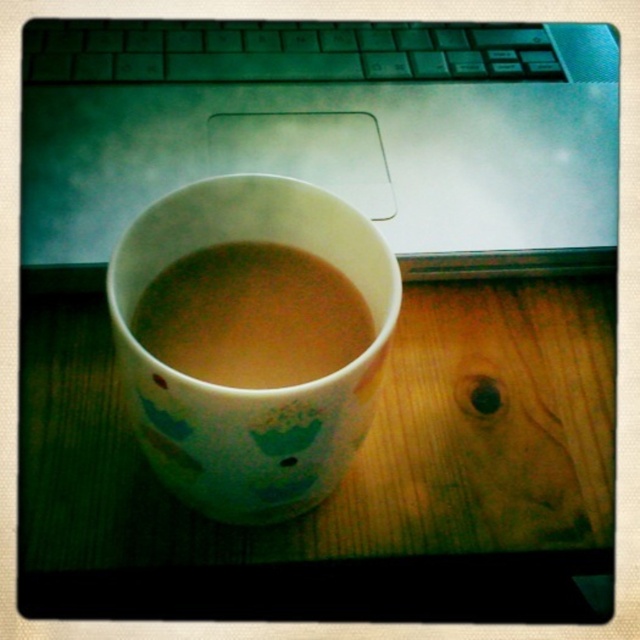
You are trying to reach for the brown matte cup at center while your hand is near the black plastic keyboard at upper center. Will your hand collide with the keyboard when reaching for the cup?

The brown matte cup at center is behind the black plastic keyboard at upper center, so your hand would have to move around or over the keyboard to reach the cup, potentially causing a collision.

Based on the photo, you are a barista preparing drinks and see the white glossy mug at center and the brown matte cup at center on the counter. Which one is closer to you?

The white glossy mug at center is closer to you because it is in front of the brown matte cup at center.